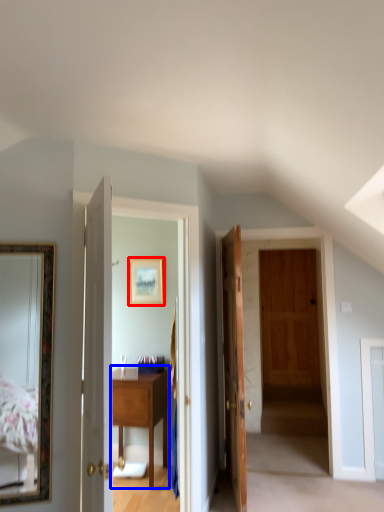
Question: Which object appears closest to the camera in this image, picture frame (highlighted by a red box) or table (highlighted by a blue box)?

Choices:
 (A) picture frame
 (B) table

Answer: (B)